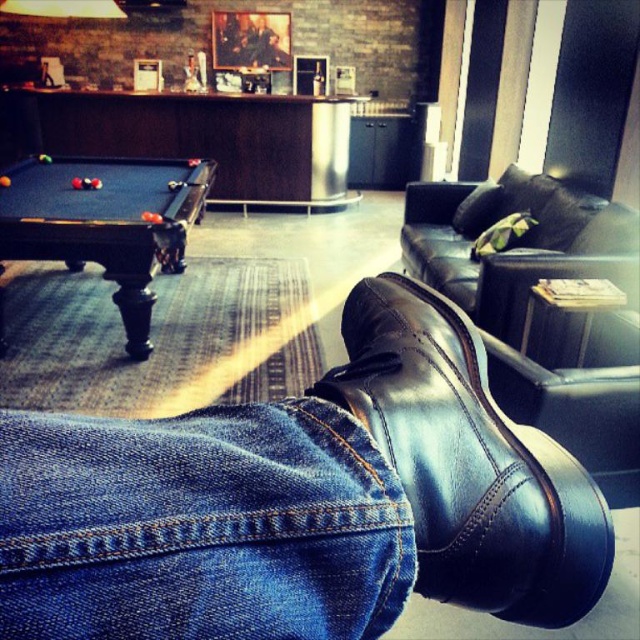
Can you confirm if denim at lower right is positioned to the right of shiny black shoe at lower right?

In fact, denim at lower right is to the left of shiny black shoe at lower right.

Is denim at lower right above shiny black shoe at lower right?

No.

You are a GUI agent. You are given a task and a screenshot of the screen. Output one action in this format:
    pyautogui.click(x=<x>, y=<y>)
    Task: Click on the denim at lower right
    
    Given the screenshot: What is the action you would take?
    click(200, 525)

Identify the location of denim at lower right. Image resolution: width=640 pixels, height=640 pixels. (200, 525).

Which is more to the left, shiny black shoe at lower right or black wooden pool table at left?

black wooden pool table at left

Is shiny black shoe at lower right shorter than black wooden pool table at left?

Correct, shiny black shoe at lower right is not as tall as black wooden pool table at left.

Does point (518, 566) come farther from viewer compared to point (60, 241)?

That is False.

You are a GUI agent. You are given a task and a screenshot of the screen. Output one action in this format:
    pyautogui.click(x=<x>, y=<y>)
    Task: Click on the shiny black shoe at lower right
    The height and width of the screenshot is (640, 640).
    Given the screenshot: What is the action you would take?
    pyautogui.click(x=468, y=461)

Between point (42, 420) and point (22, 170), which one is positioned in front?

Positioned in front is point (42, 420).

Which of these two, denim at lower right or black wooden pool table at left, stands taller?

Standing taller between the two is black wooden pool table at left.

Between point (163, 474) and point (108, 192), which one is positioned behind?

The point (108, 192) is behind.

Image resolution: width=640 pixels, height=640 pixels. Identify the location of denim at lower right. (200, 525).